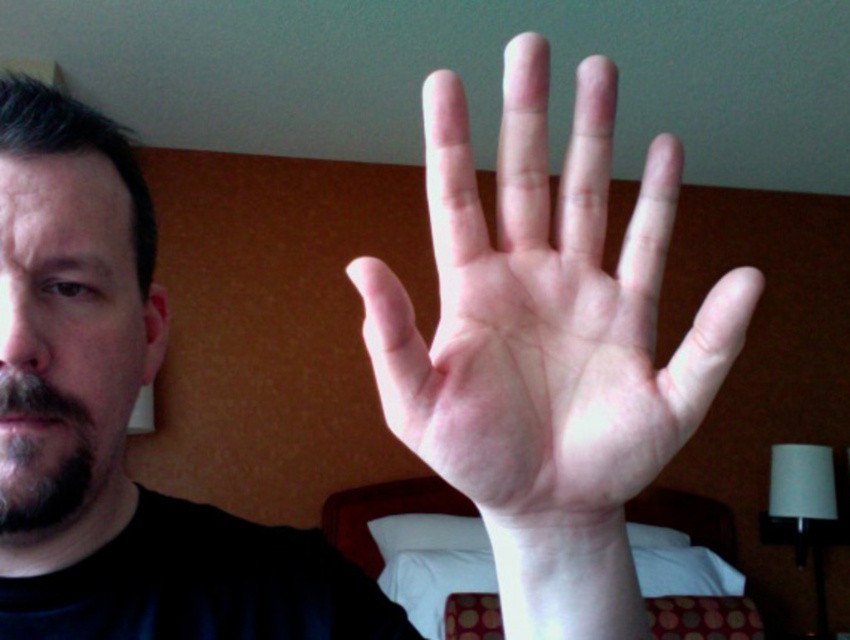
Does white fabric bed at center appear over dark brown beard at left?

No.

Where is `white fabric bed at center`? white fabric bed at center is located at coordinates (418, 552).

Does pale skin hand at center have a greater height compared to dark brown beard at left?

Indeed, pale skin hand at center has a greater height compared to dark brown beard at left.

Who is shorter, pale skin hand at center or dark brown beard at left?

dark brown beard at left

The width and height of the screenshot is (850, 640). Describe the element at coordinates (544, 316) in the screenshot. I see `pale skin hand at center` at that location.

This screenshot has width=850, height=640. I want to click on pale skin hand at center, so click(544, 316).

Does pale skin hand at center appear on the left side of white fabric bed at center?

No, pale skin hand at center is not to the left of white fabric bed at center.

Is point (531, 51) less distant than point (411, 493)?

Yes, point (531, 51) is in front of point (411, 493).

What do you see at coordinates (544, 316) in the screenshot?
I see `pale skin hand at center` at bounding box center [544, 316].

Identify the location of pale skin hand at center. The height and width of the screenshot is (640, 850). (544, 316).